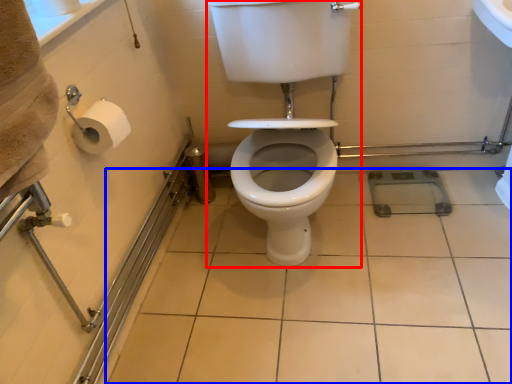
Question: Which of the following is the farthest to the observer, sit (highlighted by a red box) or ceramic tile (highlighted by a blue box)?

Choices:
 (A) sit
 (B) ceramic tile

Answer: (B)